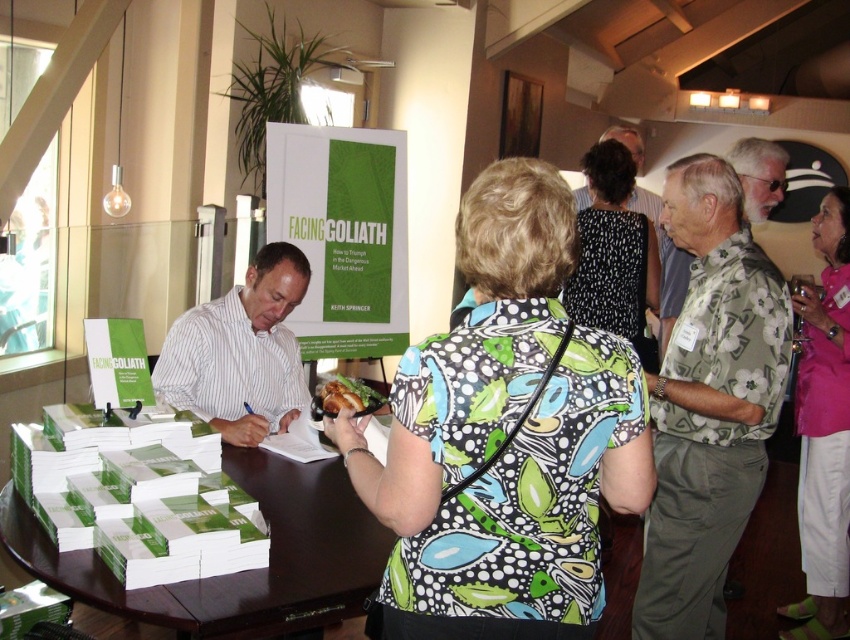
What are the coordinates of the printed fabric blouse at center in the image?

The printed fabric blouse at center is located at coordinates point (503, 436).

You are organizing a book signing event and need to place a small decorative item on the table. The green paper stacks at center and the golden crispy bread at center are both on the table. Which item takes up more vertical space?

The green paper stacks at center is taller than the golden crispy bread at center, so the green paper stacks at center takes up more vertical space.